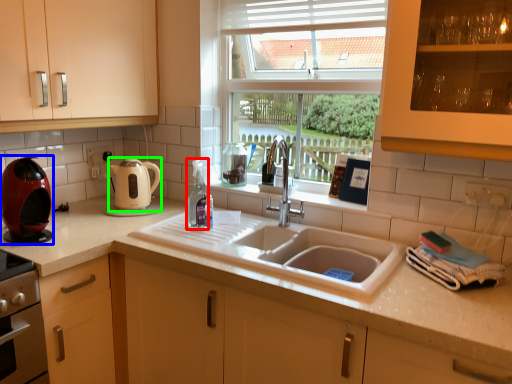
Question: Estimate the real-world distances between objects in this image. Which object is closer to bottle (highlighted by a red box), kitchen appliance (highlighted by a blue box) or kitchen appliance (highlighted by a green box)?

Choices:
 (A) kitchen appliance
 (B) kitchen appliance

Answer: (B)